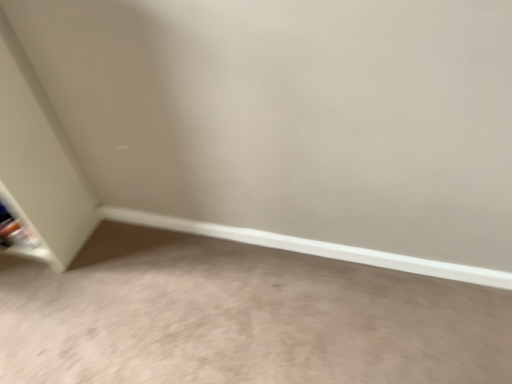
Question: Is metallic silver shelf at lower left further to the viewer compared to gray carpet at lower left?

Choices:
 (A) yes
 (B) no

Answer: (A)

Question: From a real-world perspective, is metallic silver shelf at lower left below gray carpet at lower left?

Choices:
 (A) yes
 (B) no

Answer: (B)

Question: Is metallic silver shelf at lower left next to gray carpet at lower left and touching it?

Choices:
 (A) yes
 (B) no

Answer: (B)

Question: Does metallic silver shelf at lower left have a lesser width compared to gray carpet at lower left?

Choices:
 (A) yes
 (B) no

Answer: (A)

Question: Does metallic silver shelf at lower left appear on the right side of gray carpet at lower left?

Choices:
 (A) yes
 (B) no

Answer: (B)

Question: Can you confirm if metallic silver shelf at lower left is shorter than gray carpet at lower left?

Choices:
 (A) yes
 (B) no

Answer: (B)

Question: Considering the relative sizes of gray carpet at lower left and metallic silver shelf at lower left in the image provided, is gray carpet at lower left smaller than metallic silver shelf at lower left?

Choices:
 (A) yes
 (B) no

Answer: (B)

Question: From a real-world perspective, is gray carpet at lower left physically below metallic silver shelf at lower left?

Choices:
 (A) no
 (B) yes

Answer: (B)

Question: Is gray carpet at lower left in contact with metallic silver shelf at lower left?

Choices:
 (A) no
 (B) yes

Answer: (A)

Question: Does gray carpet at lower left have a lesser width compared to metallic silver shelf at lower left?

Choices:
 (A) yes
 (B) no

Answer: (B)

Question: Is gray carpet at lower left looking in the opposite direction of metallic silver shelf at lower left?

Choices:
 (A) yes
 (B) no

Answer: (B)

Question: Is metallic silver shelf at lower left inside gray carpet at lower left?

Choices:
 (A) no
 (B) yes

Answer: (A)

Question: Looking at their shapes, would you say metallic silver shelf at lower left is wider or thinner than gray carpet at lower left?

Choices:
 (A) wide
 (B) thin

Answer: (B)